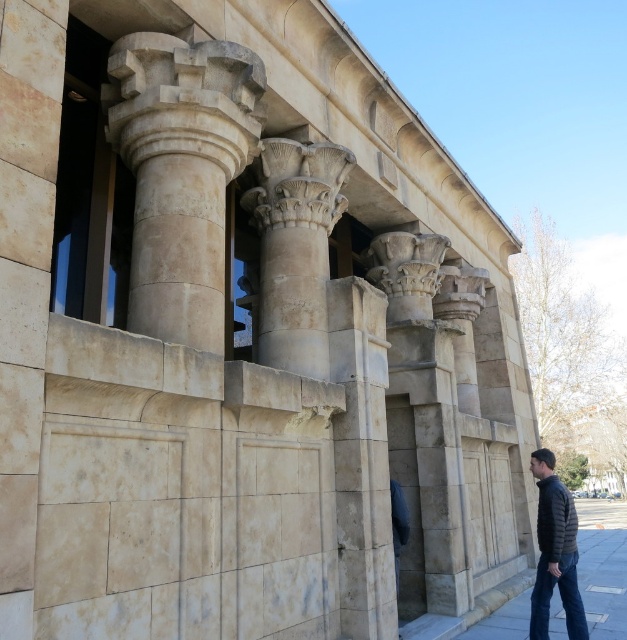
Question: Considering the relative positions of smooth concrete pavement at lower right and denim jeans at lower right in the image provided, where is smooth concrete pavement at lower right located with respect to denim jeans at lower right?

Choices:
 (A) above
 (B) below

Answer: (B)

Question: Is beige stone column at center positioned in front of smooth concrete pavement at lower right?

Choices:
 (A) yes
 (B) no

Answer: (A)

Question: Is smooth concrete pavement at lower right wider than dark gray quilted jacket at lower right?

Choices:
 (A) no
 (B) yes

Answer: (B)

Question: Which point is closer to the camera?

Choices:
 (A) smooth concrete pavement at lower right
 (B) denim jeans at lower right
 (C) white stone column at center

Answer: (B)

Question: Estimate the real-world distances between objects in this image. Which object is farther from the smooth concrete pavement at lower right?

Choices:
 (A) dark gray quilted jacket at lower right
 (B) beige stone column at center
 (C) white stone column at center

Answer: (B)

Question: Based on their relative distances, which object is farther from the dark gray quilted jacket at lower right?

Choices:
 (A) denim jeans at lower right
 (B) beige stone column at center
 (C) smooth concrete pavement at lower right

Answer: (B)